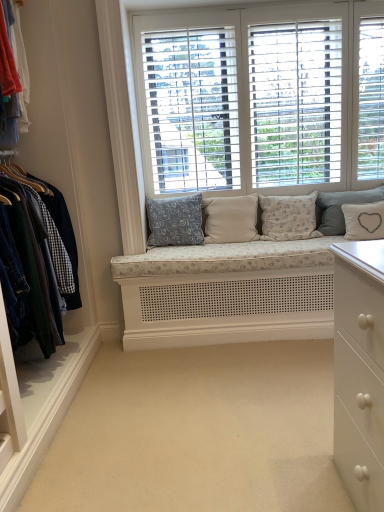
Question: Does point (301, 239) appear closer or farther from the camera than point (360, 62)?

Choices:
 (A) closer
 (B) farther

Answer: (B)

Question: Based on their sizes in the image, would you say fluffy white pillow at center, the 3th pillow in the left-to-right sequence, is bigger or smaller than white wood window at center?

Choices:
 (A) small
 (B) big

Answer: (A)

Question: Estimate the real-world distances between objects in this image. Which object is closer to the fluffy white pillow at center, the 3th pillow in the left-to-right sequence?

Choices:
 (A) white linen pillow at right, the 4th pillow when ordered from left to right
 (B) denim jacket at left
 (C) beige fabric cushion at center, which is the 4th pillow from right to left
 (D) beige carpet at center
 (E) white fabric pillow with heart design at center, which ranks as the 1th pillow in right-to-left order

Answer: (A)

Question: Based on their relative distances, which object is nearer to the beige fabric cushion at center, the 2th pillow in the left-to-right sequence?

Choices:
 (A) white fabric pillow with heart design at center, which ranks as the 1th pillow in right-to-left order
 (B) blue floral fabric pillow at center, the 1th pillow viewed from the left
 (C) beige carpet at center
 (D) fluffy white pillow at center, the 3th pillow in the left-to-right sequence
 (E) white wood window at center

Answer: (B)